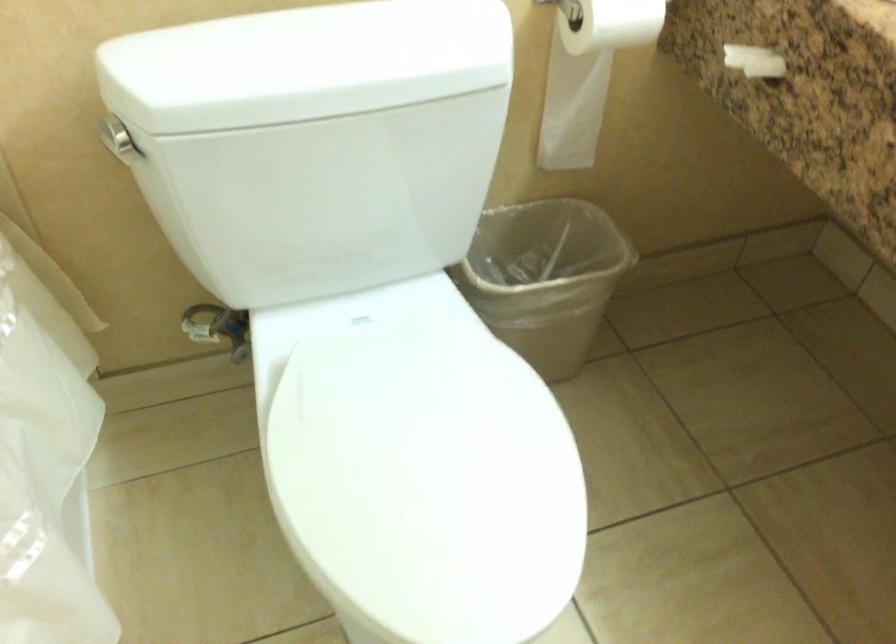
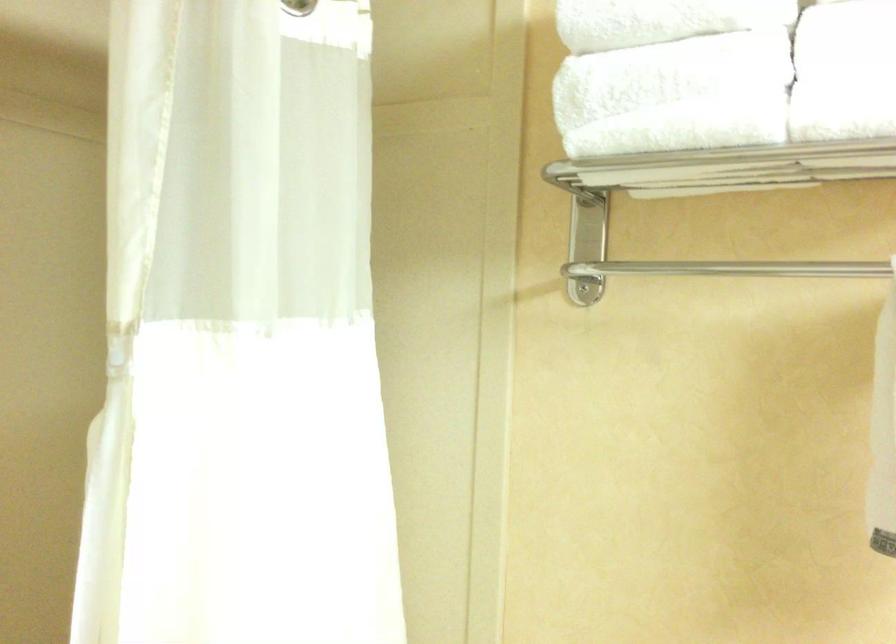
From the picture: The first image is from the beginning of the video and the second image is from the end. How did the camera likely rotate when shooting the video?

The camera's rotation is toward left-up.